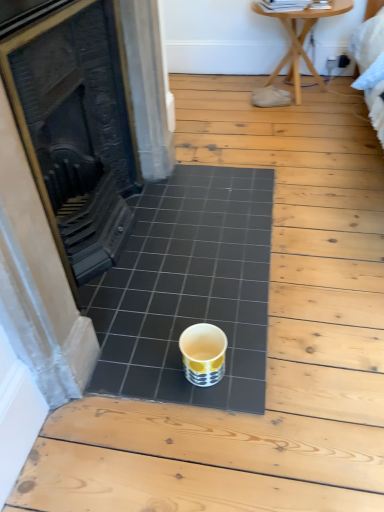
Where is `vacant space to the right of yellow and white ceramic cup at center`? The width and height of the screenshot is (384, 512). vacant space to the right of yellow and white ceramic cup at center is located at coordinates (249, 362).